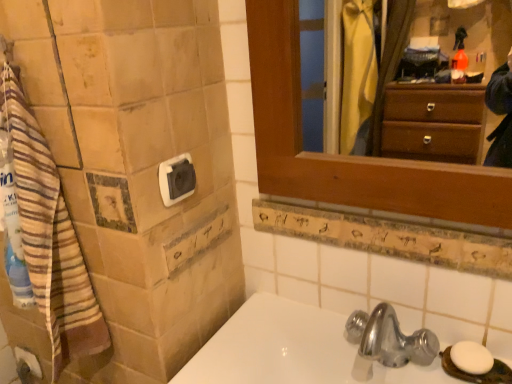
Question: Is white plastic towel bar at upper left shorter than white glossy sink at lower center?

Choices:
 (A) no
 (B) yes

Answer: (B)

Question: Is white plastic towel bar at upper left completely or partially outside of white glossy sink at lower center?

Choices:
 (A) yes
 (B) no

Answer: (A)

Question: Can you confirm if white plastic towel bar at upper left is smaller than white glossy sink at lower center?

Choices:
 (A) yes
 (B) no

Answer: (A)

Question: Considering the relative sizes of white plastic towel bar at upper left and white glossy sink at lower center in the image provided, is white plastic towel bar at upper left wider than white glossy sink at lower center?

Choices:
 (A) no
 (B) yes

Answer: (A)

Question: Is white plastic towel bar at upper left taller than white glossy sink at lower center?

Choices:
 (A) no
 (B) yes

Answer: (A)

Question: In the image, is white matte toilet paper at lower left on the left side or the right side of wooden ledge at upper center?

Choices:
 (A) left
 (B) right

Answer: (A)

Question: From a real-world perspective, is white matte toilet paper at lower left physically located above or below wooden ledge at upper center?

Choices:
 (A) below
 (B) above

Answer: (A)

Question: In terms of width, does white matte toilet paper at lower left look wider or thinner when compared to wooden ledge at upper center?

Choices:
 (A) wide
 (B) thin

Answer: (A)

Question: In terms of size, does white matte toilet paper at lower left appear bigger or smaller than wooden ledge at upper center?

Choices:
 (A) big
 (B) small

Answer: (B)

Question: Relative to white plastic towel bar at upper left, is white matte toilet paper at lower left in front or behind?

Choices:
 (A) behind
 (B) front

Answer: (A)

Question: Considering the positions of white matte toilet paper at lower left and white plastic towel bar at upper left in the image, is white matte toilet paper at lower left bigger or smaller than white plastic towel bar at upper left?

Choices:
 (A) big
 (B) small

Answer: (B)

Question: From a real-world perspective, is white matte toilet paper at lower left positioned above or below white plastic towel bar at upper left?

Choices:
 (A) below
 (B) above

Answer: (A)

Question: From the image's perspective, is white matte toilet paper at lower left located above or below white plastic towel bar at upper left?

Choices:
 (A) above
 (B) below

Answer: (B)

Question: Looking at their shapes, would you say wooden ledge at upper center is wider or thinner than white plastic towel bar at upper left?

Choices:
 (A) thin
 (B) wide

Answer: (A)

Question: In the image, is wooden ledge at upper center positioned in front of or behind white plastic towel bar at upper left?

Choices:
 (A) front
 (B) behind

Answer: (A)